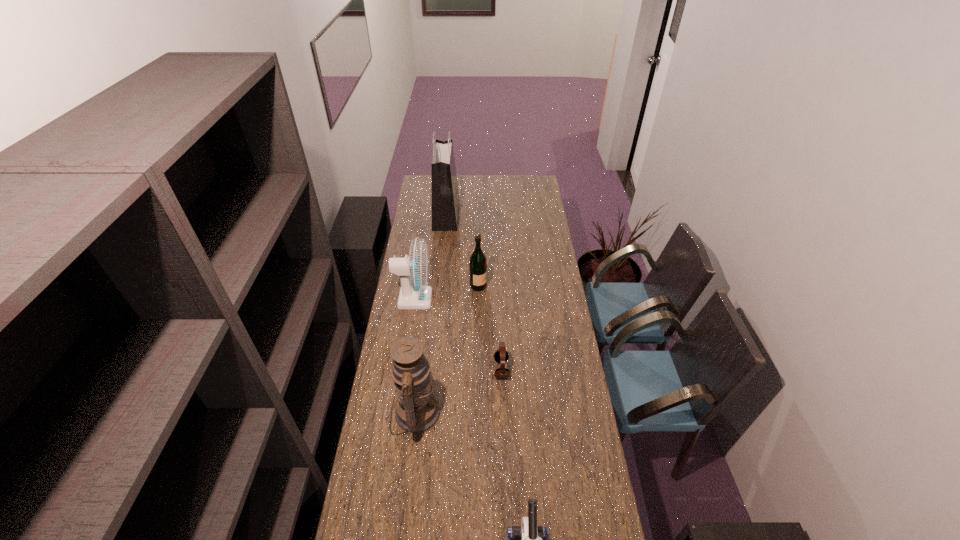
I want to click on free location located in front of the fan to face the airflow, so click(x=459, y=299).

Identify the location of vacant space located 0.300m on the front-facing side of the liquor. (546, 287).

In order to click on vacant region located on the ear pads of the shortest object in this screenshot , I will do `click(442, 369)`.

Find the location of a particular element. Image resolution: width=960 pixels, height=540 pixels. free region located 0.110m on the ear pads of the shortest object is located at coordinates (468, 369).

The height and width of the screenshot is (540, 960). Find the location of `free spot located 0.340m on the ear pads of the shortest object`. free spot located 0.340m on the ear pads of the shortest object is located at coordinates (413, 369).

Locate an element on the screen. The width and height of the screenshot is (960, 540). shopping bag located in the left edge section of the desktop is located at coordinates (445, 196).

You are a GUI agent. You are given a task and a screenshot of the screen. Output one action in this format:
    pyautogui.click(x=<x>, y=<y>)
    Task: Click on the oil lamp located in the left edge section of the desktop
    
    Given the screenshot: What is the action you would take?
    pyautogui.click(x=417, y=410)

Locate an element on the screen. The image size is (960, 540). fan that is at the left edge is located at coordinates (414, 271).

Identify the location of free spot at the far edge of the desktop. The image size is (960, 540). (492, 188).

Where is `free spot at the left edge of the desktop`? Image resolution: width=960 pixels, height=540 pixels. free spot at the left edge of the desktop is located at coordinates (414, 218).